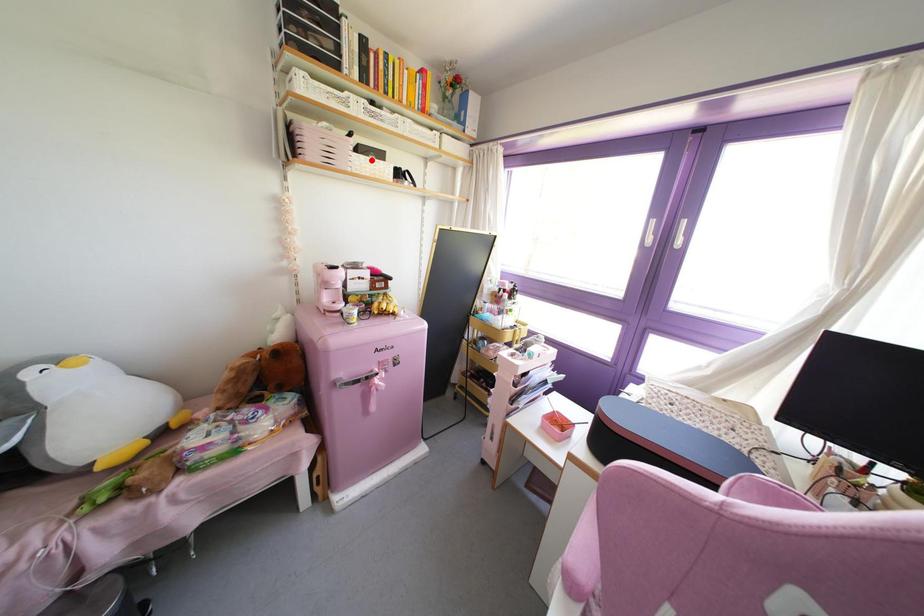
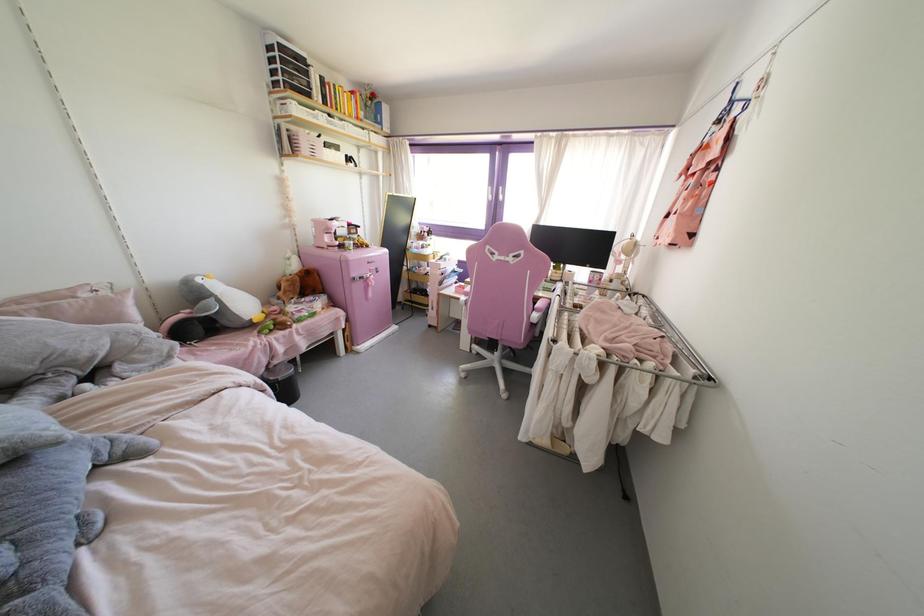
Locate, in the second image, the point that corresponds to the highlighted location in the first image.

(333, 151)